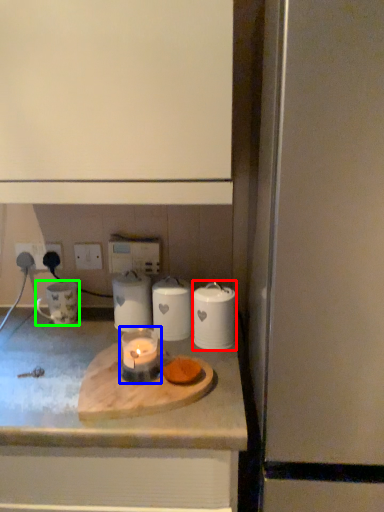
Question: Considering the real-world distances, which object is closest to appliance (highlighted by a red box)? candle holder (highlighted by a blue box) or appliance (highlighted by a green box).

Choices:
 (A) candle holder
 (B) appliance

Answer: (A)